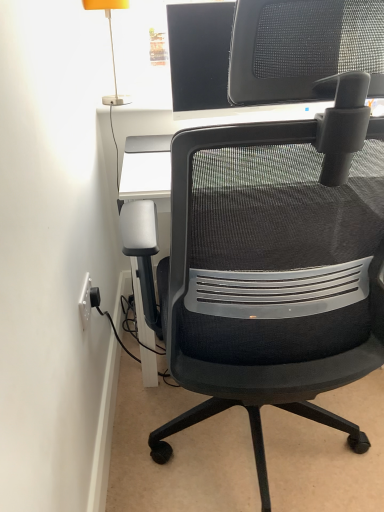
Where is `blank area beneath black mesh office chair at center (from a real-world perspective)`? blank area beneath black mesh office chair at center (from a real-world perspective) is located at coordinates (249, 456).